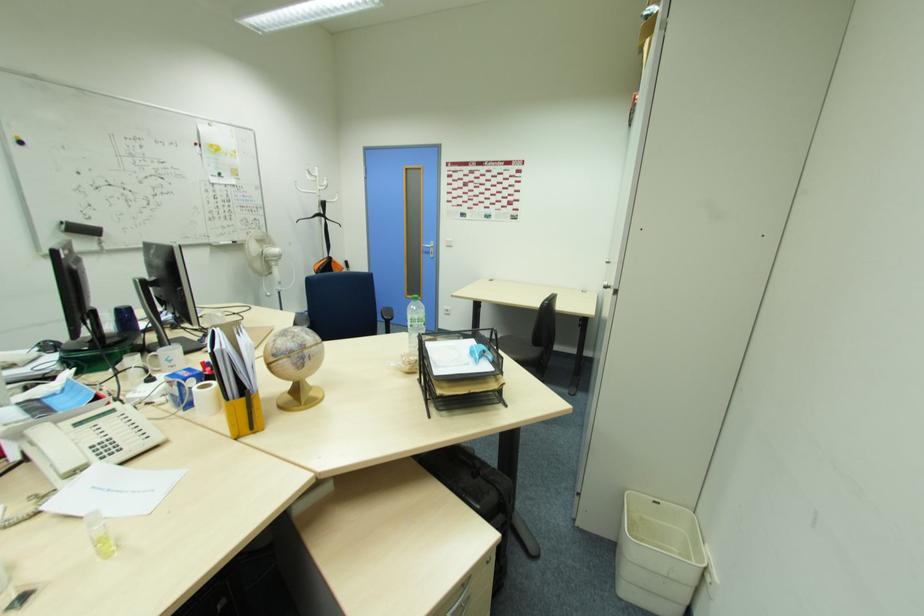
The image size is (924, 616). Identify the location of silver door handle. (429, 249).